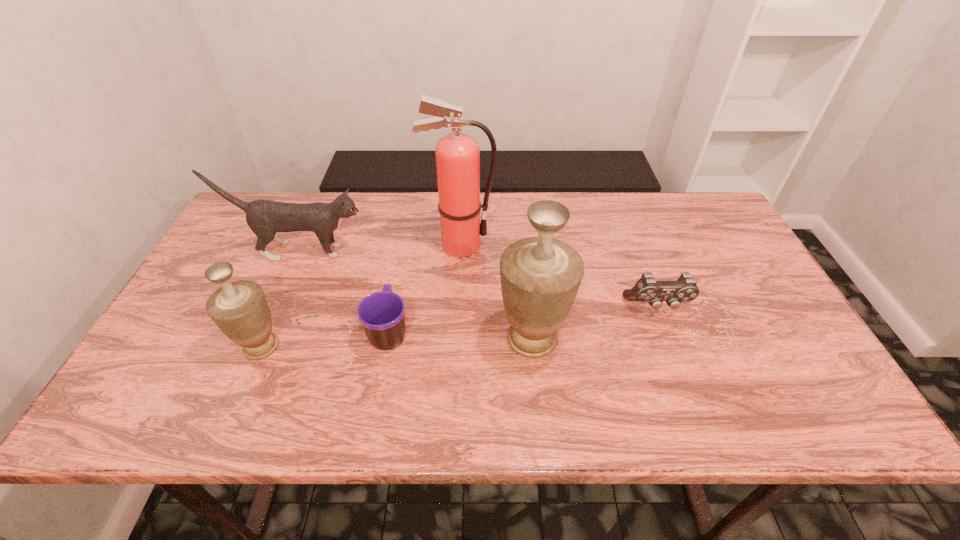
Where is `free spot between the cat and the third object from left to right`? The image size is (960, 540). free spot between the cat and the third object from left to right is located at coordinates (345, 291).

Locate an element on the screen. object identified as the second closest to the shorter urn is located at coordinates (265, 218).

This screenshot has height=540, width=960. I want to click on object that can be found as the closest to the fire extinguisher, so point(265,218).

Where is `vacant area in the image that satisfies the following two spatial constraints: 1. with the handle on the side of the fourth object from right to left; 2. at the face of the cat`? The height and width of the screenshot is (540, 960). vacant area in the image that satisfies the following two spatial constraints: 1. with the handle on the side of the fourth object from right to left; 2. at the face of the cat is located at coordinates (404, 251).

This screenshot has height=540, width=960. Identify the location of vacant area that satisfies the following two spatial constraints: 1. on the hose direction of the fifth shortest object; 2. on the right side of the fire extinguisher. (455, 339).

Locate an element on the screen. free point that satisfies the following two spatial constraints: 1. at the face of the cat; 2. on the back side of the taller urn is located at coordinates click(262, 339).

At what (x,y) coordinates should I click in order to perform the action: click on vacant region that satisfies the following two spatial constraints: 1. at the face of the cat; 2. on the left side of the shorter urn. Please return your answer as a coordinate pair (x, y). This screenshot has width=960, height=540. Looking at the image, I should click on (259, 347).

Identify the location of free point that satisfies the following two spatial constraints: 1. at the face of the shorter urn; 2. on the right side of the cat. This screenshot has height=540, width=960. (259, 347).

Locate an element on the screen. The height and width of the screenshot is (540, 960). vacant space that satisfies the following two spatial constraints: 1. at the face of the cat; 2. with the handle on the side of the fourth object from right to left is located at coordinates (266, 331).

You are a GUI agent. You are given a task and a screenshot of the screen. Output one action in this format:
    pyautogui.click(x=<x>, y=<y>)
    Task: Click on the free space that satisfies the following two spatial constraints: 1. on the hose direction of the fire extinguisher; 2. on the left side of the taller urn
    
    Given the screenshot: What is the action you would take?
    pyautogui.click(x=455, y=339)